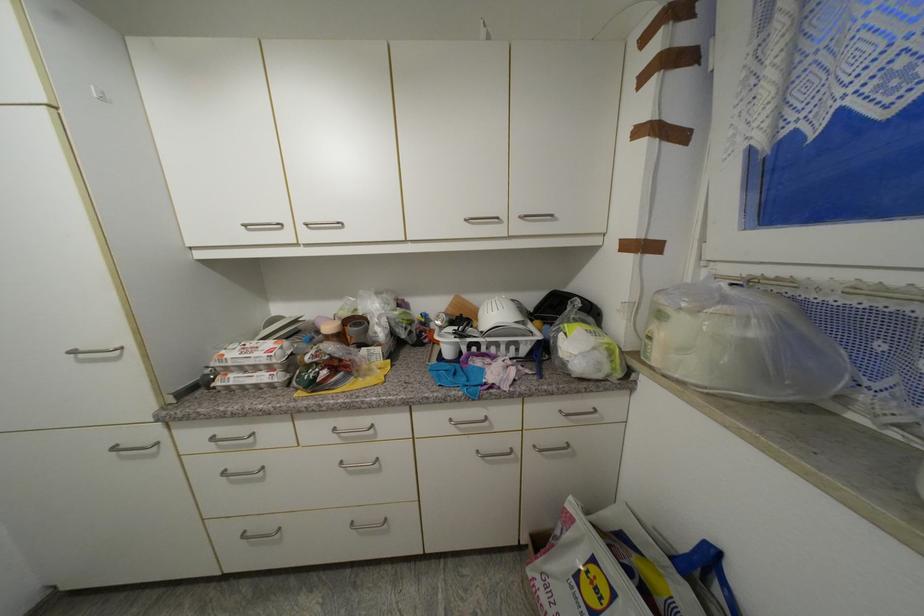
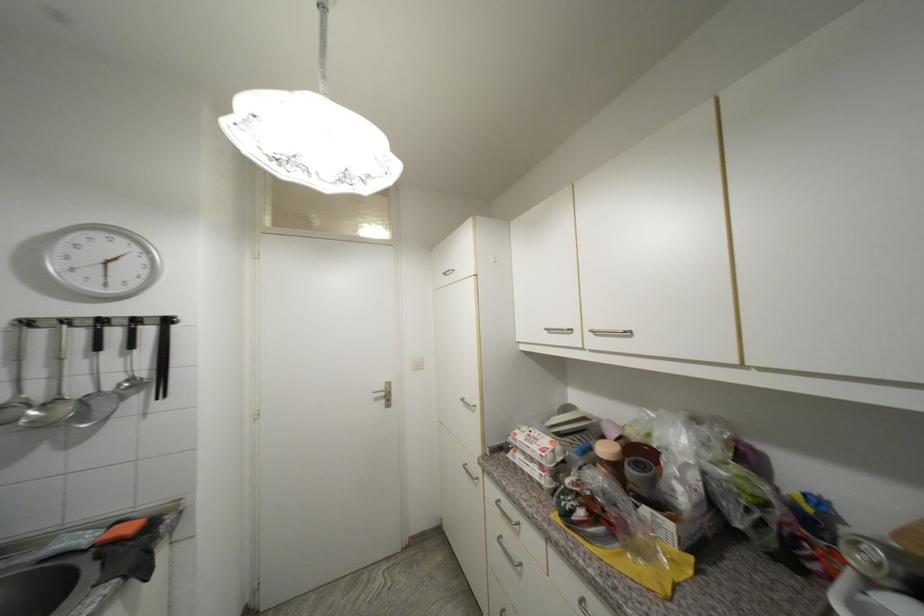
Find the pixel in the second image that matches point 314,223 in the first image.

(601, 330)